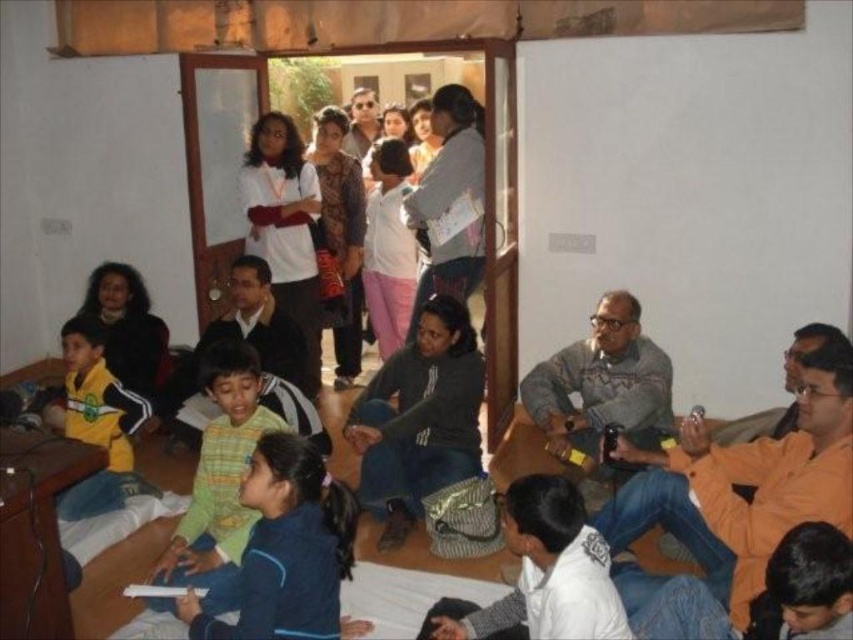
Which is behind, point (450, 541) or point (277, 541)?

The point (450, 541) is more distant.

Who is higher up, dark gray fabric jacket at center or blue fleece jacket at lower left?

Positioned higher is dark gray fabric jacket at center.

Is point (410, 509) in front of point (252, 620)?

No.

The height and width of the screenshot is (640, 853). What are the coordinates of `dark gray fabric jacket at center` in the screenshot? It's located at (427, 436).

Which is below, blue fleece jacket at lower left or yellow jersey at left?

Positioned lower is blue fleece jacket at lower left.

Consider the image. Can you confirm if blue fleece jacket at lower left is positioned to the right of yellow jersey at left?

Indeed, blue fleece jacket at lower left is positioned on the right side of yellow jersey at left.

Does point (329, 512) come closer to viewer compared to point (86, 502)?

Yes, it is in front of point (86, 502).

Locate an element on the screen. The height and width of the screenshot is (640, 853). blue fleece jacket at lower left is located at coordinates (288, 550).

Can you confirm if striped knit sweater at center is bigger than yellow jersey at left?

Actually, striped knit sweater at center might be smaller than yellow jersey at left.

Identify the location of striped knit sweater at center. The width and height of the screenshot is (853, 640). pyautogui.click(x=219, y=480).

Describe the element at coordinates (219, 480) in the screenshot. I see `striped knit sweater at center` at that location.

I want to click on striped knit sweater at center, so click(219, 480).